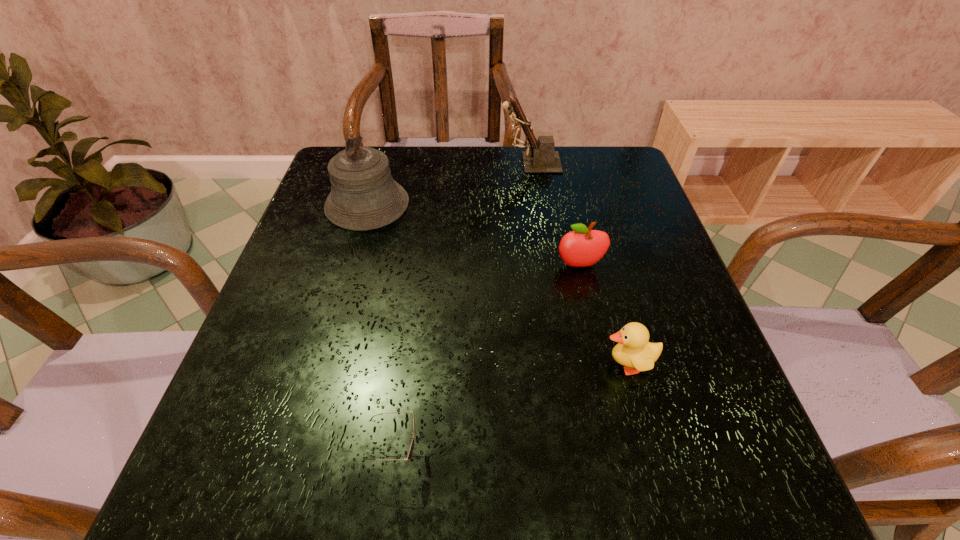
Locate an element on the screen. The width and height of the screenshot is (960, 540). unoccupied area between the leftmost object and the third nearest object is located at coordinates (473, 235).

At what (x,y) coordinates should I click in order to perform the action: click on free spot between the shortest object and the bell. Please return your answer as a coordinate pair (x, y). The width and height of the screenshot is (960, 540). Looking at the image, I should click on (381, 329).

You are a GUI agent. You are given a task and a screenshot of the screen. Output one action in this format:
    pyautogui.click(x=<x>, y=<y>)
    Task: Click on the vacant space in between the sunglasses and the fourth farthest object
    
    Given the screenshot: What is the action you would take?
    pyautogui.click(x=512, y=409)

This screenshot has width=960, height=540. In order to click on vacant area that lies between the third nearest object and the fourth farthest object in this screenshot , I will do `click(604, 315)`.

At what (x,y) coordinates should I click in order to perform the action: click on vacant space that's between the second object from left to right and the figurine. Please return your answer as a coordinate pair (x, y). Image resolution: width=960 pixels, height=540 pixels. Looking at the image, I should click on (463, 308).

At what (x,y) coordinates should I click in order to perform the action: click on object that is the third closest to the third nearest object. Please return your answer as a coordinate pair (x, y). This screenshot has width=960, height=540. Looking at the image, I should click on (364, 196).

Point out which object is positioned as the second nearest to the leftmost object. Please provide its 2D coordinates. Your answer should be formatted as a tuple, i.e. [(x, y)], where the tuple contains the x and y coordinates of a point satisfying the conditions above.

[(581, 247)]

The image size is (960, 540). I want to click on free location that satisfies the following two spatial constraints: 1. on the front-facing side of the figurine; 2. on the back side of the third farthest object, so click(545, 265).

Locate an element on the screen. The height and width of the screenshot is (540, 960). blank space that satisfies the following two spatial constraints: 1. on the front-facing side of the figurine; 2. on the right side of the third nearest object is located at coordinates point(545,265).

The height and width of the screenshot is (540, 960). What are the coordinates of `blank area in the image that satisfies the following two spatial constraints: 1. on the front-facing side of the apple; 2. on the right side of the figurine` in the screenshot? It's located at (545, 265).